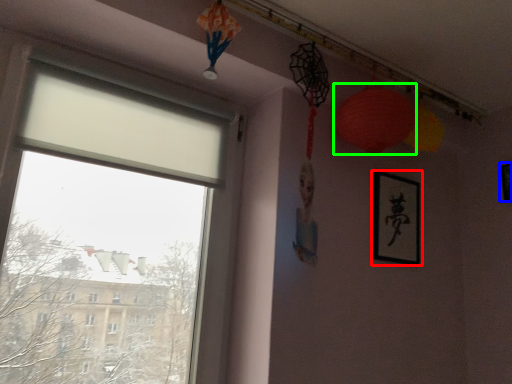
Question: Which object is positioned farthest from picture frame (highlighted by a red box)? Select from picture frame (highlighted by a blue box) and lantern (highlighted by a green box).

Choices:
 (A) picture frame
 (B) lantern

Answer: (A)